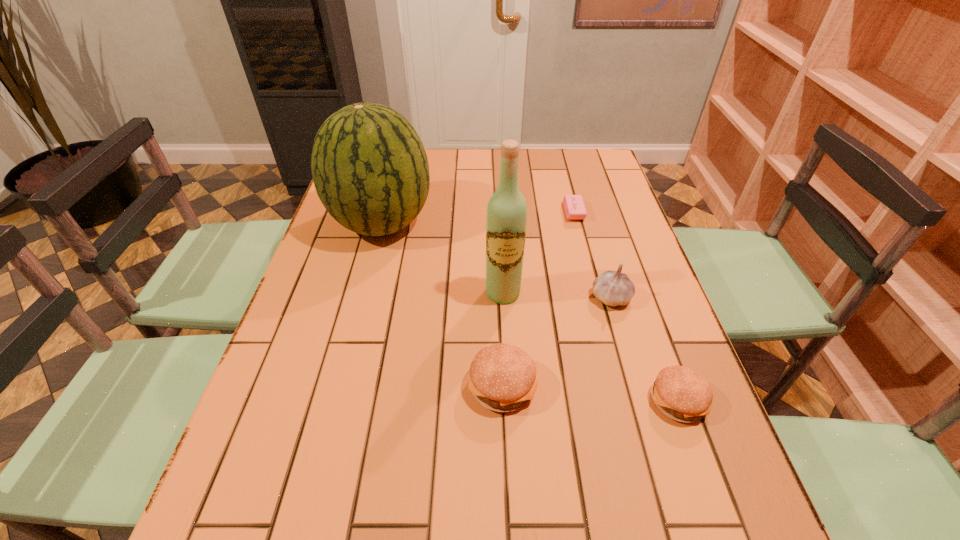
Find the location of `the left hamburger`. the left hamburger is located at coordinates (502, 378).

Find the location of a particular element. The width and height of the screenshot is (960, 540). the fourth tallest object is located at coordinates (502, 378).

You are a GUI agent. You are given a task and a screenshot of the screen. Output one action in this format:
    pyautogui.click(x=<x>, y=<y>)
    Task: Click on the right hamburger
    Image resolution: width=960 pixels, height=540 pixels.
    Given the screenshot: What is the action you would take?
    point(682,394)

Find the location of a particular element. the shorter hamburger is located at coordinates (682, 394).

Locate an element on the screen. the shortest object is located at coordinates (574, 206).

Identify the location of wine bottle. (506, 218).

Find the location of a particular element. The height and width of the screenshot is (540, 960). watermelon is located at coordinates (370, 170).

I want to click on the fifth shortest object, so click(x=370, y=170).

Locate an element on the screen. The image size is (960, 540). the third tallest object is located at coordinates (613, 288).

Where is `vacant region located on the right of the left hamburger`? vacant region located on the right of the left hamburger is located at coordinates (x=574, y=385).